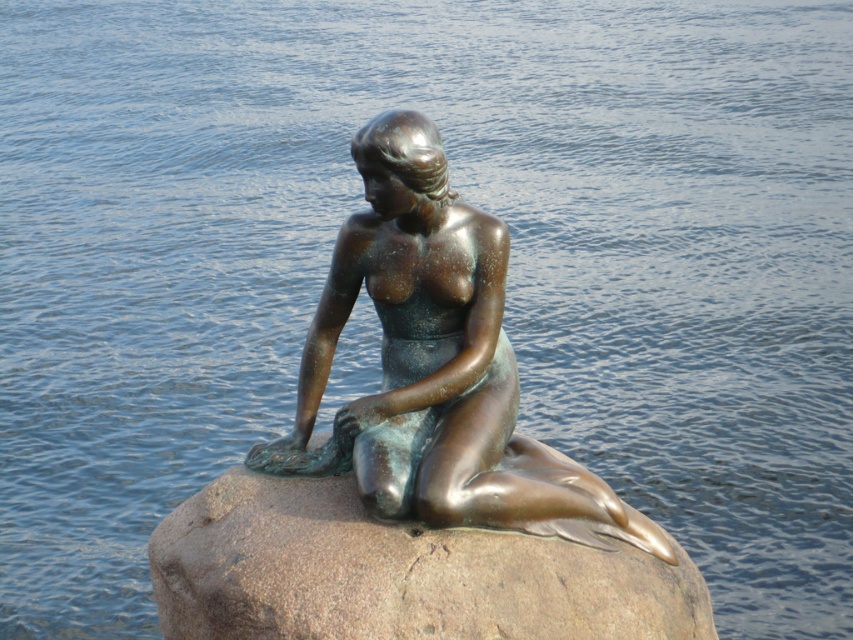
Question: Does bronze statue at center appear on the right side of brown granite rock at center?

Choices:
 (A) yes
 (B) no

Answer: (A)

Question: Which point is farther to the camera?

Choices:
 (A) (663, 609)
 (B) (486, 289)

Answer: (B)

Question: Does bronze statue at center have a larger size compared to brown granite rock at center?

Choices:
 (A) yes
 (B) no

Answer: (A)

Question: Can you confirm if bronze statue at center is positioned above brown granite rock at center?

Choices:
 (A) yes
 (B) no

Answer: (A)

Question: Among these points, which one is farthest from the camera?

Choices:
 (A) (527, 525)
 (B) (361, 609)

Answer: (A)